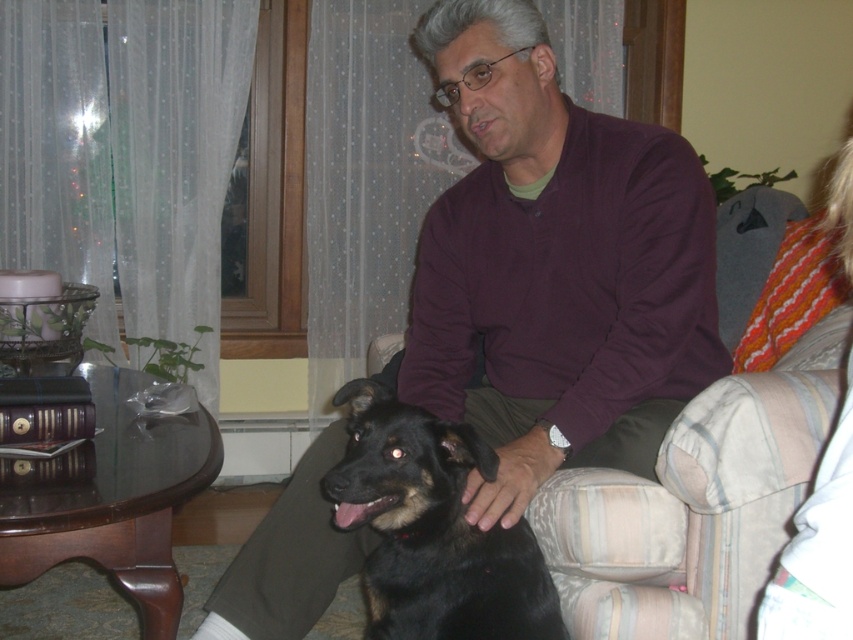
You are a fashion designer who wants to create a matching outfit for the man and the dog in the image. Given that the maroon sweater at center is larger in size than the black fur dog at center, which one would require a bigger piece of fabric to make a similar design?

The maroon sweater at center would require a bigger piece of fabric because it is larger in size than the black fur dog at center.

You are a photographer trying to capture a closeup of the dog while keeping the man in the frame. The camera can only focus on one point at a time. If you choose between point A at point (287, 586) and point B at point (369, 605), which point should you select to ensure the dog is in focus?

Point A at point (287, 586) is closer to the camera than point B at point (369, 605). Therefore, selecting point A will ensure the dog is in focus as it is nearer to the camera.

You are a delivery person who needs to place a small package between the maroon sweater at center and the black fur dog at center. Can you fit the package in the space between them?

The maroon sweater at center is 8.74 inches away from the black fur dog at center. Since the package is small, it can fit in the space between them.